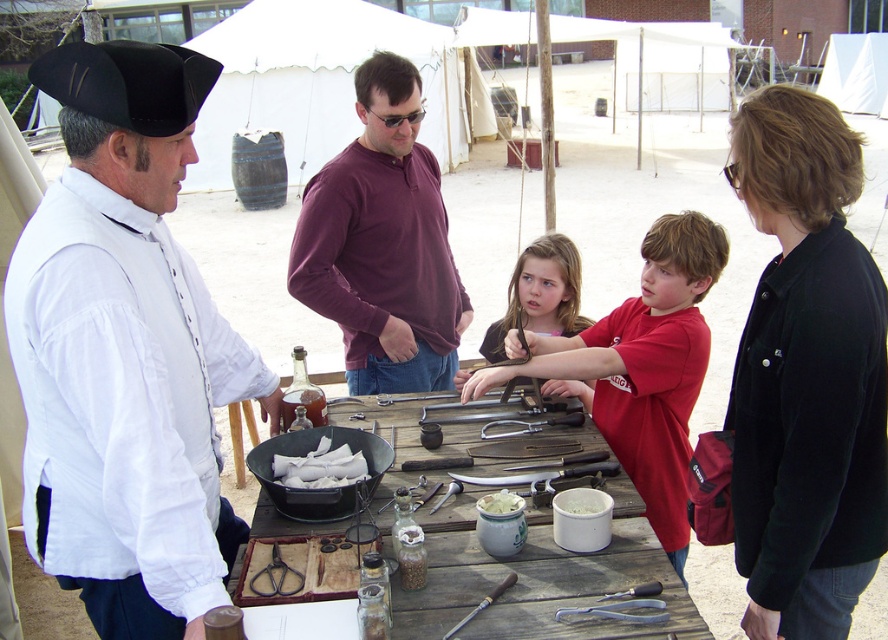
Question: Can you confirm if maroon long-sleeve shirt at center is positioned below wooden handle chisel at center?

Choices:
 (A) yes
 (B) no

Answer: (B)

Question: Which of these objects is positioned closest to the brown leather belt at center?

Choices:
 (A) black cotton jacket at upper right
 (B) white paper napkins at center
 (C) wooden handle chisel at center

Answer: (B)

Question: Where is black cotton jacket at upper right located in relation to wooden handle chisel at center in the image?

Choices:
 (A) below
 (B) above

Answer: (B)

Question: Which point is farther to the camera?

Choices:
 (A) white creamy substance at center
 (B) maroon long-sleeve shirt at center
 (C) black cotton jacket at upper right
 (D) wooden table at center

Answer: (B)

Question: Which object is farther from the camera taking this photo?

Choices:
 (A) wooden table at center
 (B) white paper napkins at center

Answer: (B)

Question: Does white cotton shirt at left have a smaller size compared to maroon long-sleeve shirt at center?

Choices:
 (A) yes
 (B) no

Answer: (B)